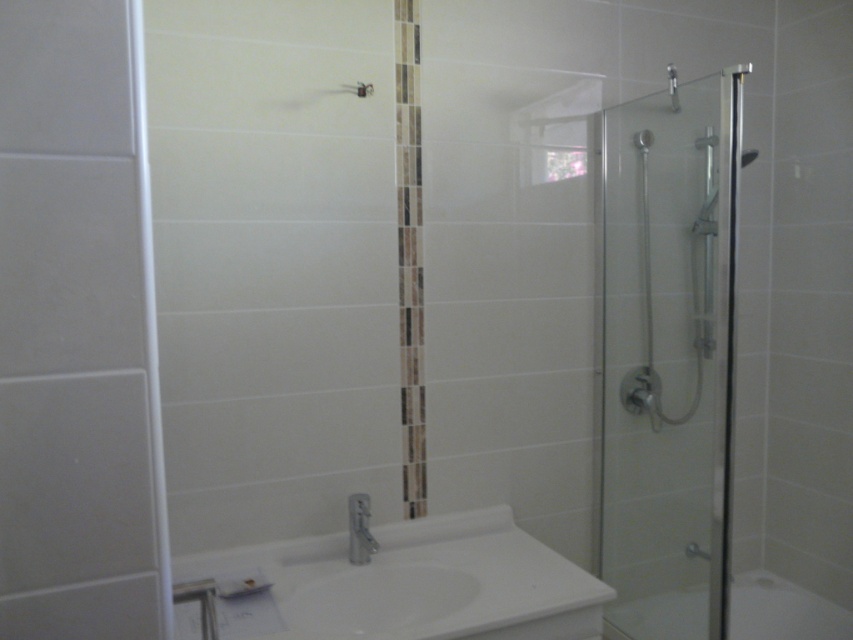
You are a delivery person carrying a package that is 2 meters long. You need to enter the bathroom and place it near the transparent glass shower door at right. Can you fit the package through the entrance without bending it?

The distance between the transparent glass shower door at right and the viewer is 2.16 meters. Since the package is 2 meters long, it can fit through the entrance as the space is slightly larger than the package.

You are a plumber inspecting the bathroom. You need to determine if the white glossy bathtub at lower right can fit through a doorway that is the same width as the silver metallic faucet at lower center. Based on their widths, what is your conclusion?

The white glossy bathtub at lower right is wider than the silver metallic faucet at lower center, so it cannot fit through the doorway which is the same width as the faucet.

You are standing in the bathroom and want to locate the transparent glass shower door at right. According to the coordinates provided, where exactly should you look?

The transparent glass shower door at right is located at point 0.558 on the x axis and 0.783 on the y axis.